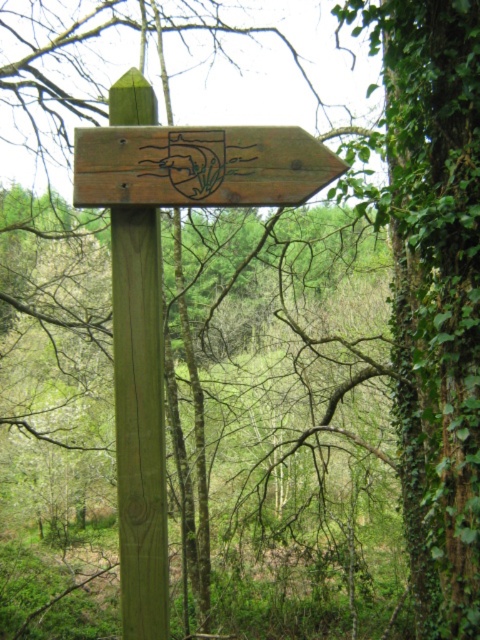
You are a hiker trying to read the wooden signpost at upper center but notice the green wood post at center is blocking your view. Can you move around to see the signpost clearly?

The green wood post at center is in front of the wooden signpost at upper center, so moving to the side of the green wood post at center would allow you to see the wooden signpost at upper center clearly.

You are a hiker carrying a 16 inch long backpack. You see a green wood post at center and a wooden signpost at upper center. Can your backpack fit between them?

The green wood post at center is 16.53 inches away from wooden signpost at upper center. Since your backpack is 16 inches long, it can fit between them as the distance is slightly larger than the backpack.